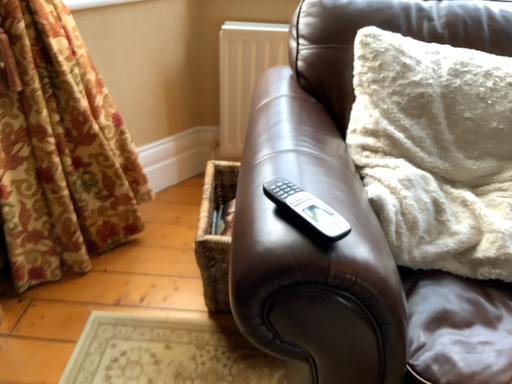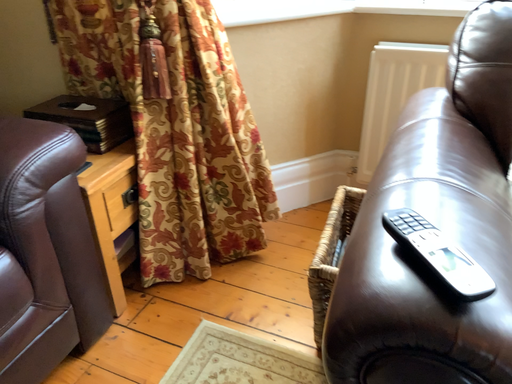
Question: How did the camera likely rotate when shooting the video?

Choices:
 (A) rotated left
 (B) rotated right

Answer: (A)